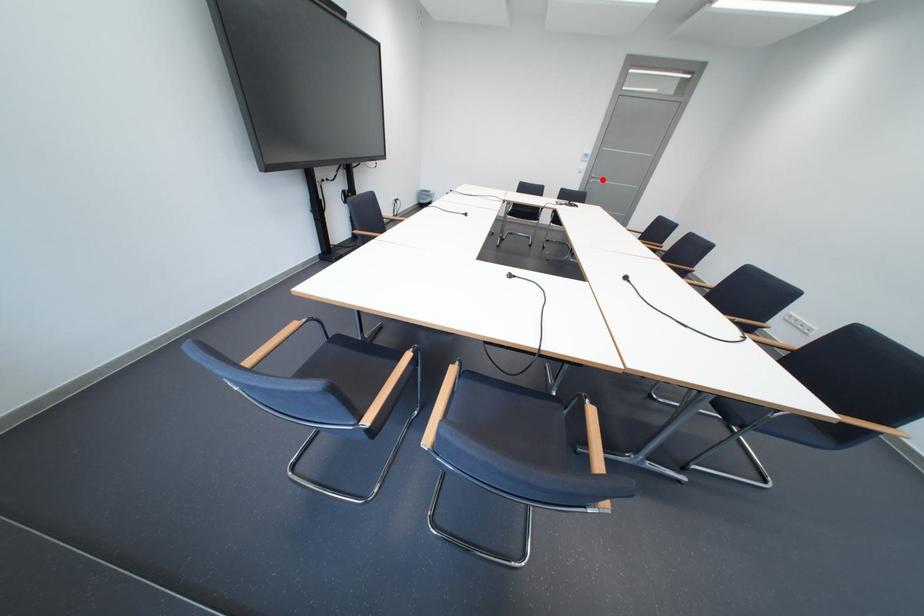
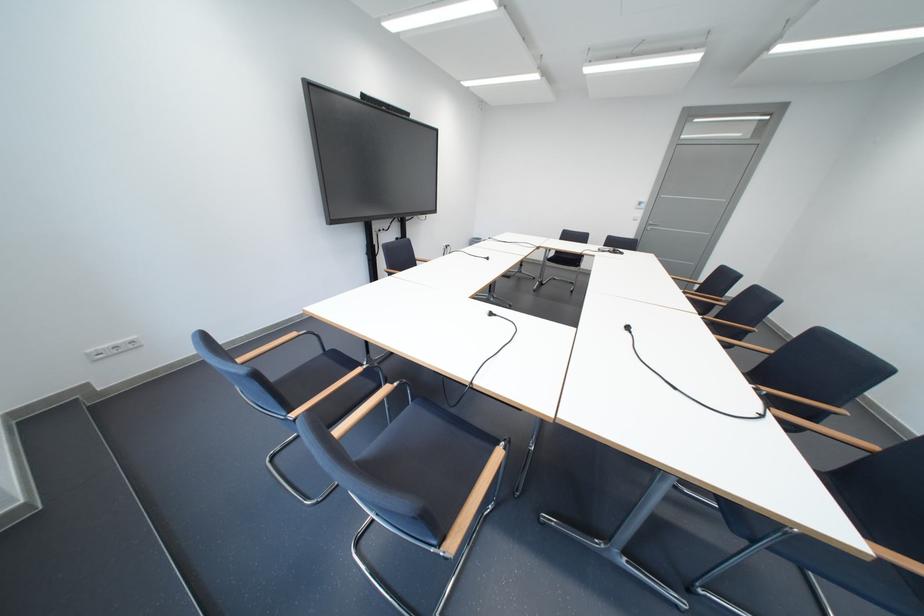
Question: I am providing you with two images of the same scene from different viewpoints. In image1, a red point is highlighted. Considering the same 3D point in image2, which of the following is correct?

Choices:
 (A) It is closer
 (B) It is farther

Answer: (B)